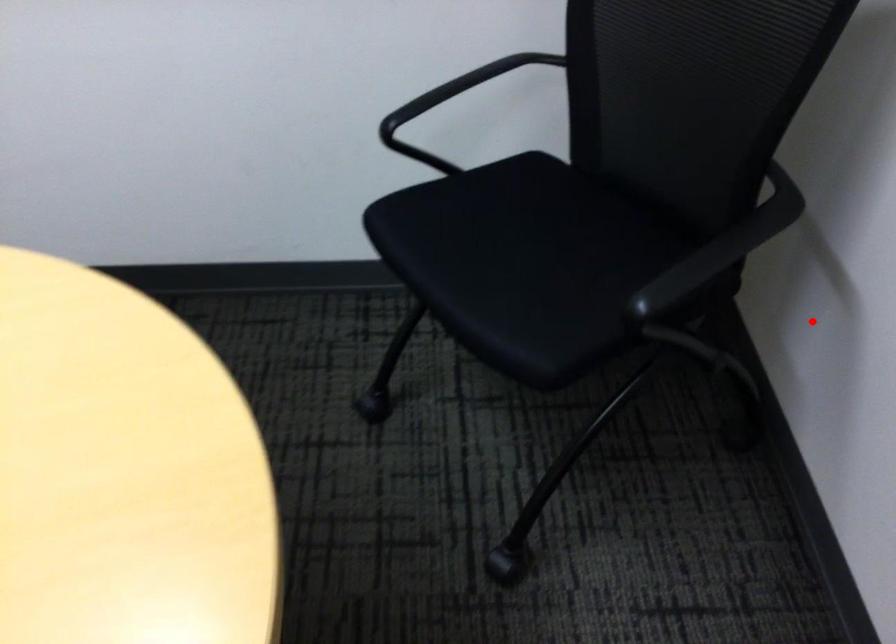
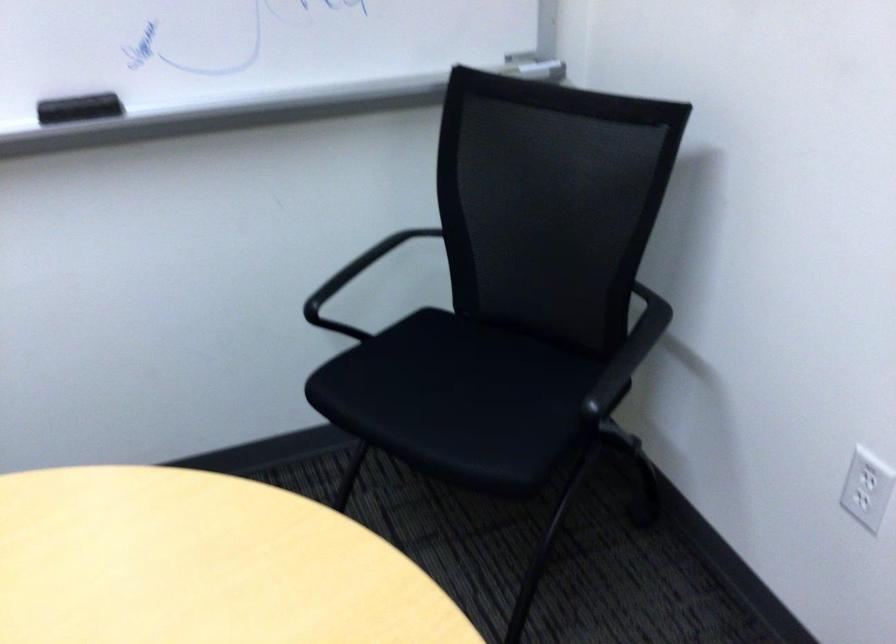
Question: A red point is marked in image1. In image2, is the corresponding 3D point closer to the camera or farther? Reply with the corresponding letter.

Choices:
 (A) The corresponding 3D point is closer.
 (B) The corresponding 3D point is farther.

Answer: (B)